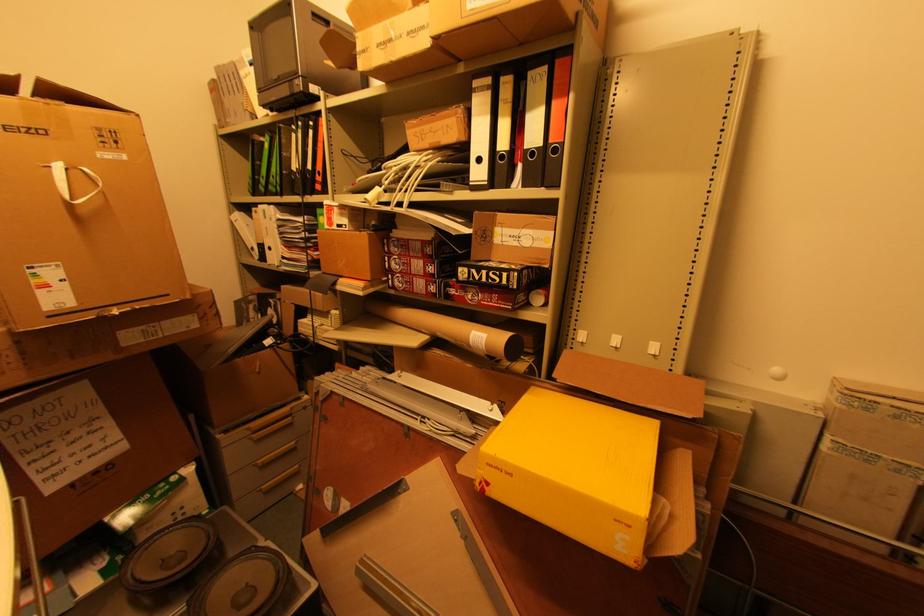
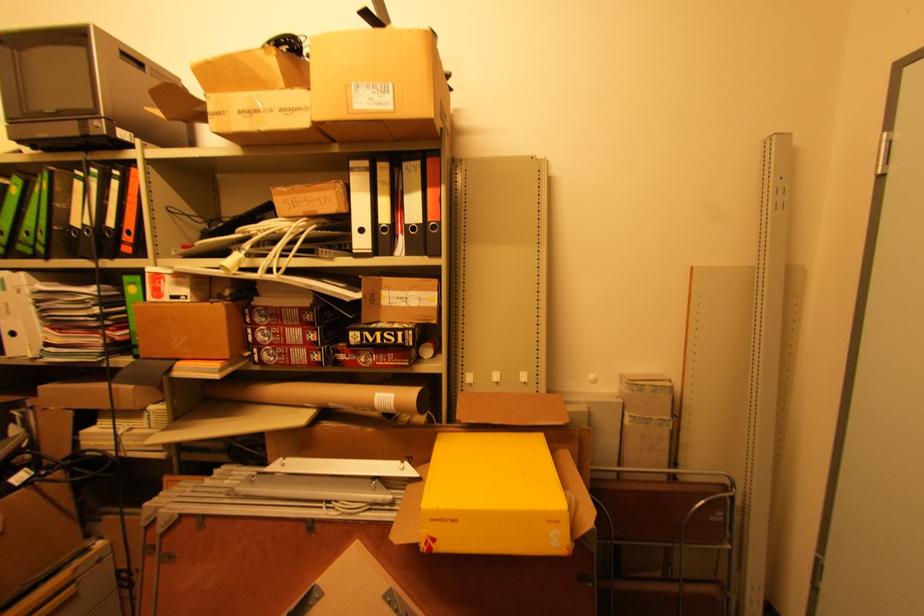
The point at (492, 240) is marked in the first image. Where is the corresponding point in the second image?

(380, 302)